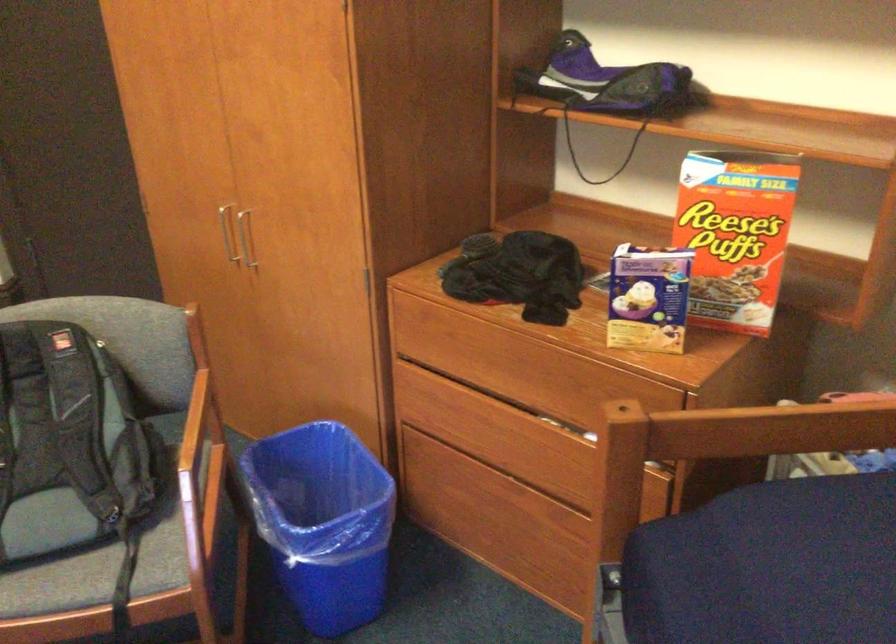
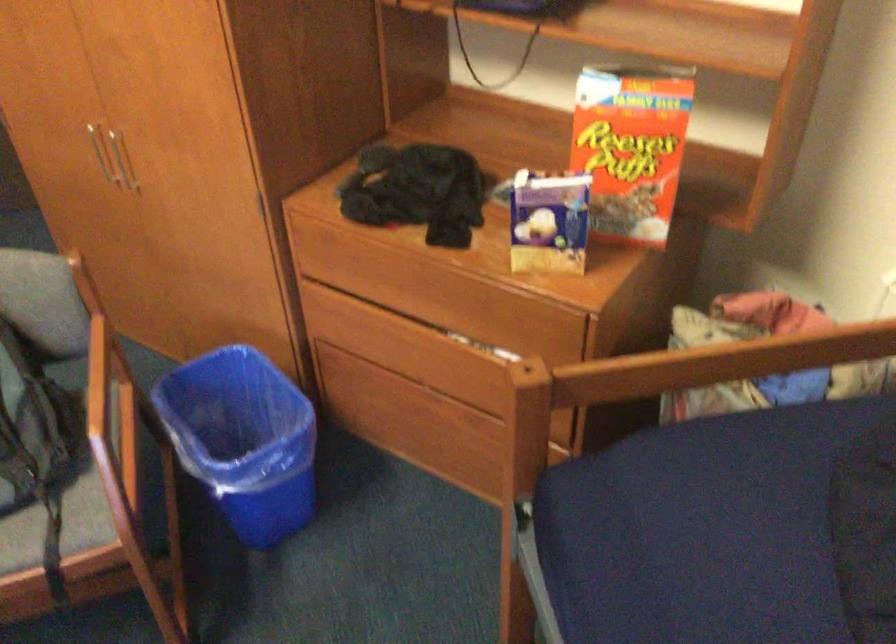
The point at [647,295] is marked in the first image. Where is the corresponding point in the second image?

(548, 223)